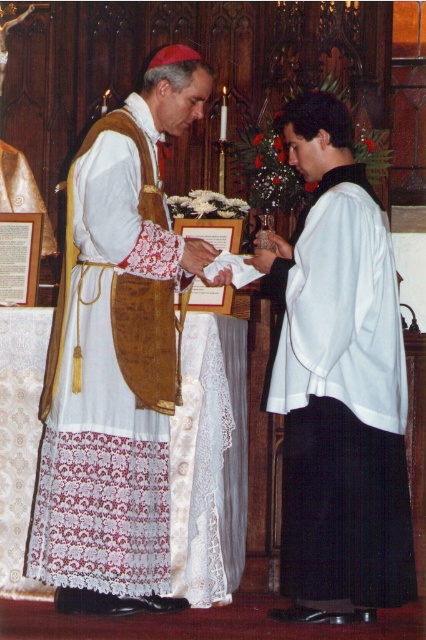
Question: Observing the image, what is the correct spatial positioning of matte gold vestment at center in reference to white satin robe at center?

Choices:
 (A) right
 (B) left

Answer: (B)

Question: Can you confirm if matte gold vestment at center is thinner than white satin robe at center?

Choices:
 (A) no
 (B) yes

Answer: (A)

Question: Does matte gold vestment at center have a larger size compared to white satin robe at center?

Choices:
 (A) no
 (B) yes

Answer: (B)

Question: Which point is closer to the camera?

Choices:
 (A) white satin robe at center
 (B) matte gold vestment at center

Answer: (B)

Question: Which of the following is the farthest from the observer?

Choices:
 (A) (175, 83)
 (B) (330, 515)

Answer: (A)

Question: Among these points, which one is nearest to the camera?

Choices:
 (A) (135, 579)
 (B) (411, 545)

Answer: (A)